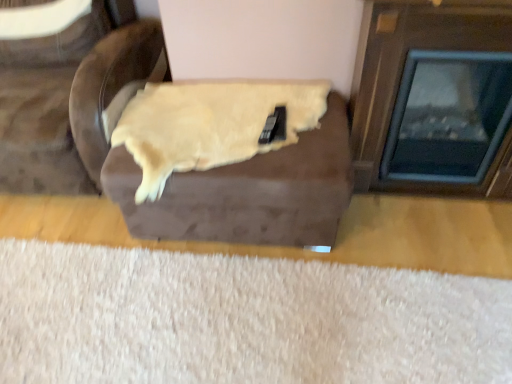
Question: From the image's perspective, is brown suede ottoman at center, the first furniture when ordered from right to left, below white fluffy rug at lower center?

Choices:
 (A) no
 (B) yes

Answer: (A)

Question: Considering the relative sizes of brown suede ottoman at center, the first furniture when ordered from right to left, and white fluffy rug at lower center in the image provided, is brown suede ottoman at center, the first furniture when ordered from right to left, thinner than white fluffy rug at lower center?

Choices:
 (A) no
 (B) yes

Answer: (B)

Question: Considering the relative sizes of brown suede ottoman at center, the first furniture when ordered from right to left, and white fluffy rug at lower center in the image provided, is brown suede ottoman at center, the first furniture when ordered from right to left, smaller than white fluffy rug at lower center?

Choices:
 (A) yes
 (B) no

Answer: (B)

Question: From the image's perspective, would you say brown suede ottoman at center, the first furniture when ordered from right to left, is positioned over white fluffy rug at lower center?

Choices:
 (A) yes
 (B) no

Answer: (A)

Question: Is white fluffy rug at lower center located within brown suede ottoman at center, the second furniture in the left-to-right sequence?

Choices:
 (A) yes
 (B) no

Answer: (B)

Question: Considering the relative positions of brown suede ottoman at center, the first furniture when ordered from right to left, and white fluffy rug at lower center in the image provided, is brown suede ottoman at center, the first furniture when ordered from right to left, to the right of white fluffy rug at lower center from the viewer's perspective?

Choices:
 (A) yes
 (B) no

Answer: (A)

Question: Does wooden fireplace at right have a smaller size compared to brown suede armchair at upper left, the 2th furniture viewed from the right?

Choices:
 (A) no
 (B) yes

Answer: (B)

Question: Is brown suede armchair at upper left, the 2th furniture viewed from the right, inside wooden fireplace at right?

Choices:
 (A) yes
 (B) no

Answer: (B)

Question: Is wooden fireplace at right not within brown suede armchair at upper left, acting as the first furniture starting from the left?

Choices:
 (A) no
 (B) yes

Answer: (B)

Question: Can you confirm if wooden fireplace at right is positioned to the left of brown suede armchair at upper left, acting as the first furniture starting from the left?

Choices:
 (A) yes
 (B) no

Answer: (B)

Question: Is wooden fireplace at right positioned with its back to brown suede armchair at upper left, acting as the first furniture starting from the left?

Choices:
 (A) no
 (B) yes

Answer: (A)

Question: Are wooden fireplace at right and brown suede armchair at upper left, acting as the first furniture starting from the left, far apart?

Choices:
 (A) yes
 (B) no

Answer: (A)

Question: Is brown suede ottoman at center, the second furniture in the left-to-right sequence, oriented towards brown suede armchair at upper left, acting as the first furniture starting from the left?

Choices:
 (A) yes
 (B) no

Answer: (B)